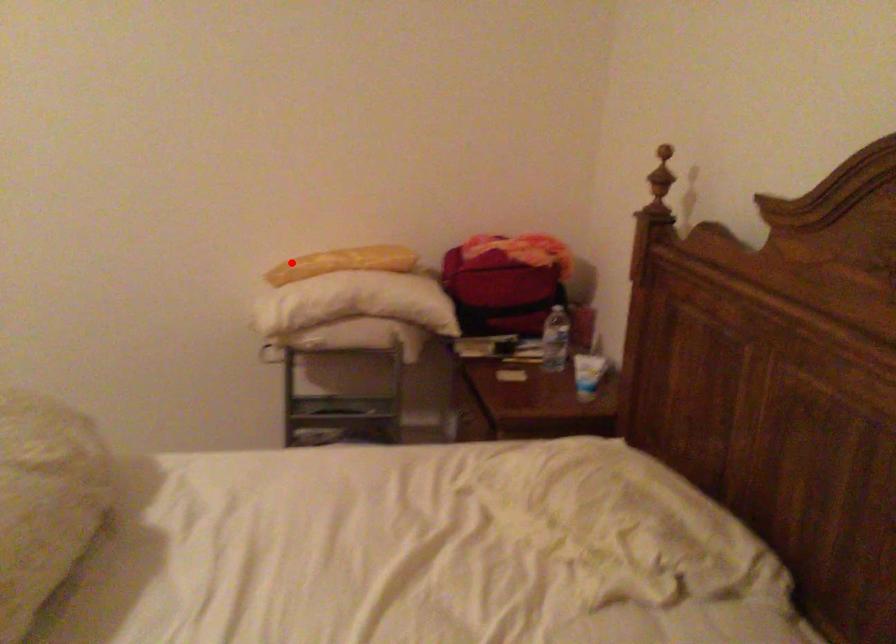
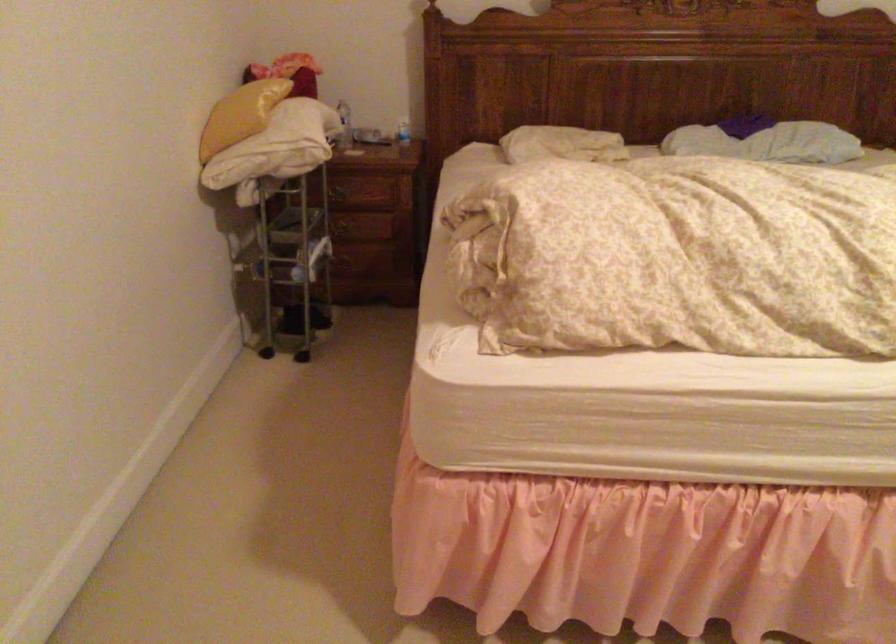
The point at the highlighted location is marked in the first image. Where is the corresponding point in the second image?

(240, 115)